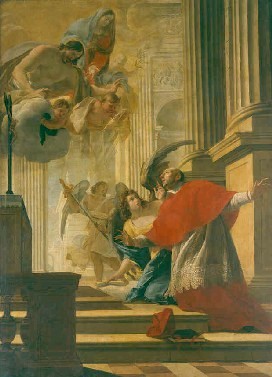
I want to click on painting, so click(x=134, y=164).